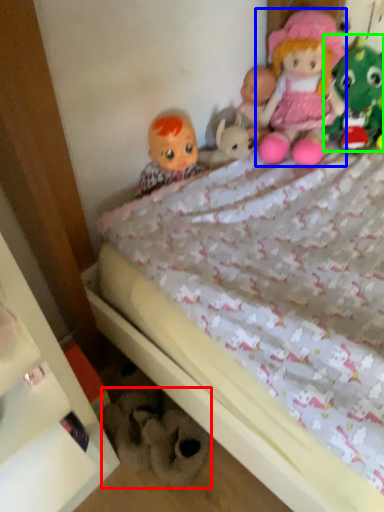
Question: Which is farther away from toy (highlighted by a red box)? doll (highlighted by a blue box) or toy (highlighted by a green box)?

Choices:
 (A) doll
 (B) toy

Answer: (B)